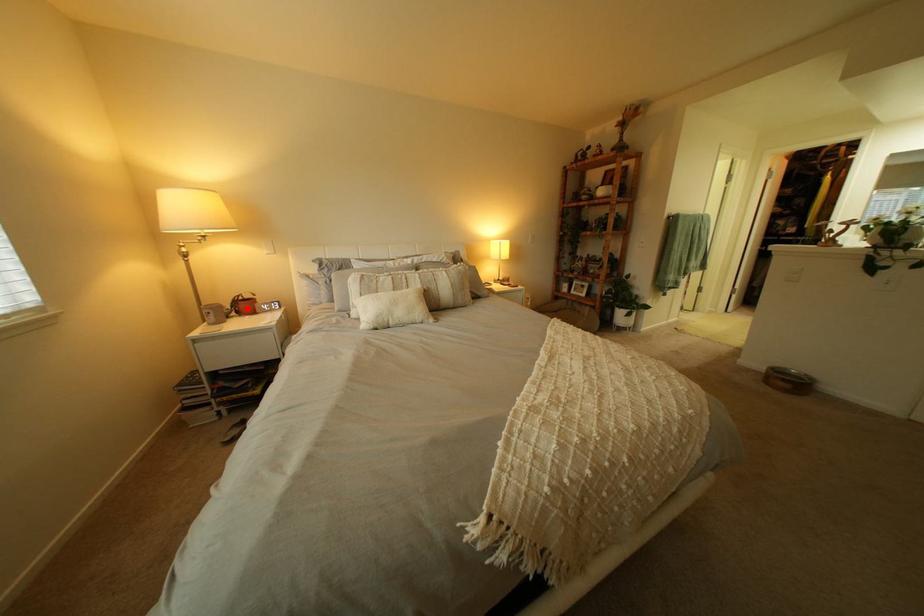
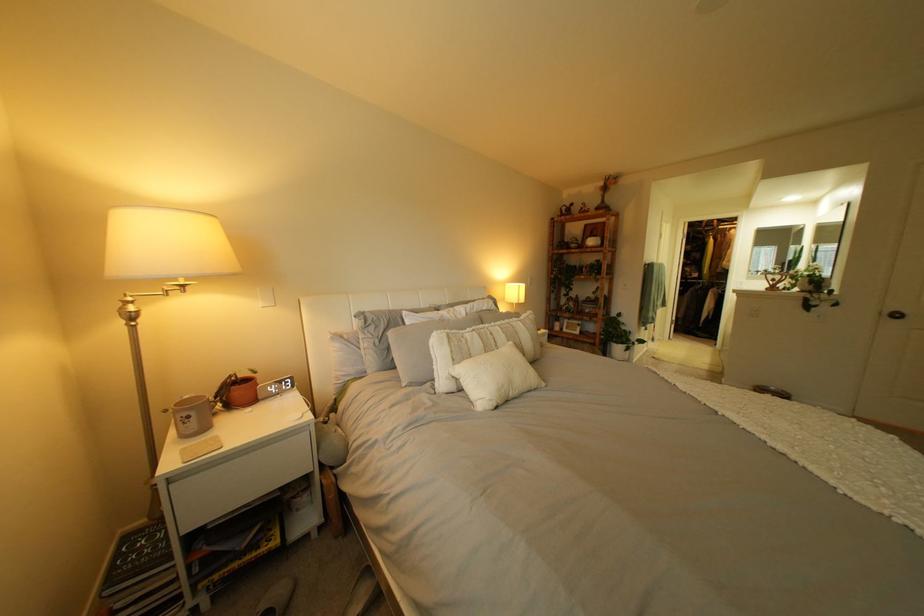
The point at the highlighted location is marked in the first image. Where is the corresponding point in the second image?

(232, 399)